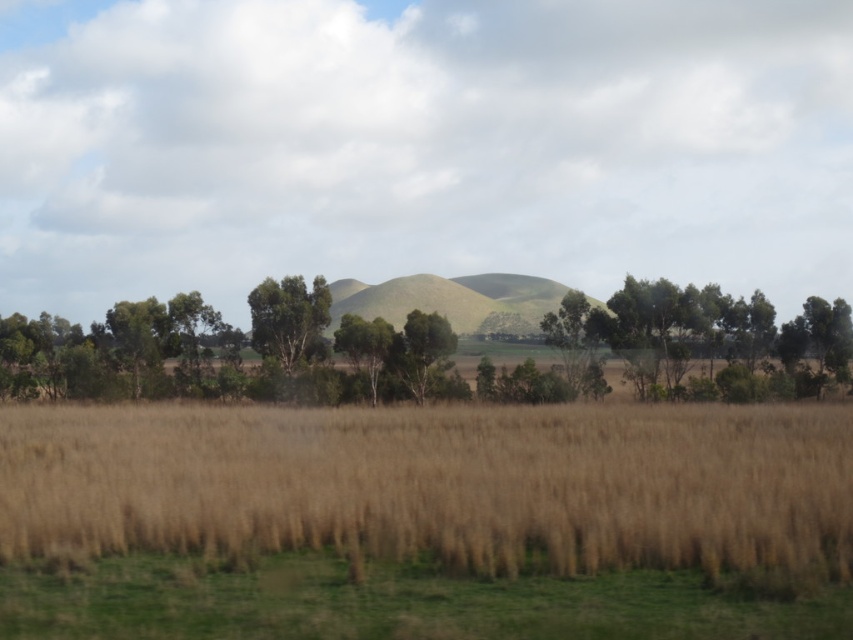
You are standing in the rural landscape scene and want to walk from the point at coordinates point (97, 472) to the point at coordinates point (259, 316). Which direction should you face to walk towards the second point?

You should face towards the upper left direction because point (259, 316) is further away from the viewer compared to point (97, 472).